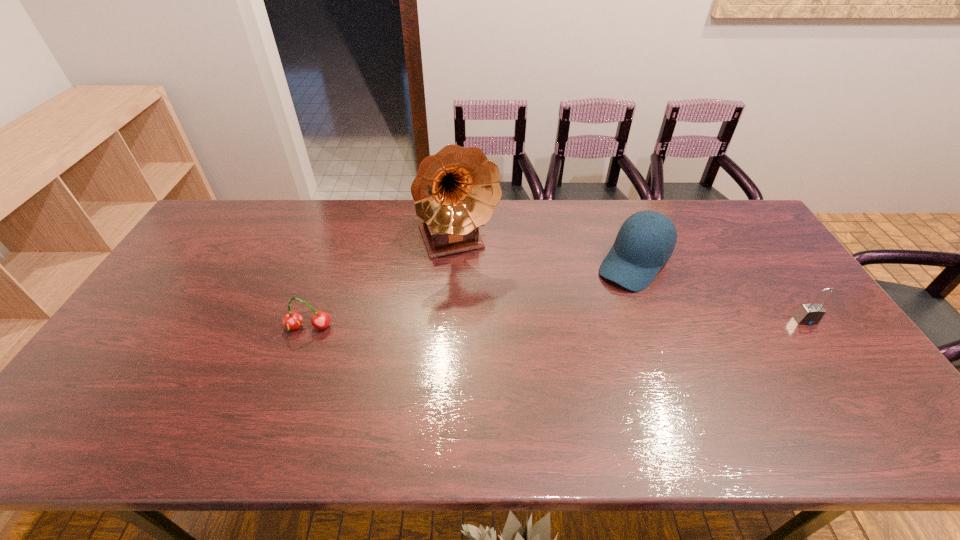
Locate an element on the screen. This screenshot has height=540, width=960. free location at the right edge of the desktop is located at coordinates (762, 281).

The image size is (960, 540). I want to click on vacant space at the far right corner, so click(733, 222).

Find the location of a particular element. free space between the second tallest object and the cherry is located at coordinates (471, 295).

This screenshot has height=540, width=960. I want to click on empty space that is in between the cherry and the rightmost object, so click(557, 324).

This screenshot has width=960, height=540. Find the location of `vacant region between the rightmost object and the leftmost object`. vacant region between the rightmost object and the leftmost object is located at coordinates (557, 324).

Identify the location of free point between the cherry and the rightmost object. The height and width of the screenshot is (540, 960). (557, 324).

The image size is (960, 540). Identify the location of free spot between the second object from right to left and the leftmost object. (471, 295).

Where is `free point between the cherry and the third shortest object`? free point between the cherry and the third shortest object is located at coordinates pyautogui.click(x=471, y=295).

Where is `vacant area that lies between the third object from left to right and the padlock`? vacant area that lies between the third object from left to right and the padlock is located at coordinates (720, 292).

Locate an element on the screen. The image size is (960, 540). vacant space that's between the leftmost object and the tallest object is located at coordinates (383, 285).